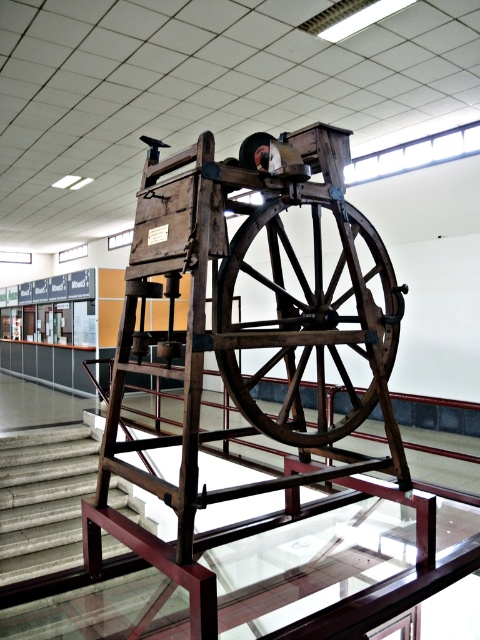
Does dark brown wooden wheel at center have a lesser height compared to concrete stairs at lower left?

No, dark brown wooden wheel at center is not shorter than concrete stairs at lower left.

This screenshot has width=480, height=640. Describe the element at coordinates (312, 273) in the screenshot. I see `dark brown wooden wheel at center` at that location.

Find the location of `dark brown wooden wheel at center`. dark brown wooden wheel at center is located at coordinates (312, 273).

At what (x,y) coordinates should I click in order to perform the action: click on dark brown wooden wheel at center. Please return your answer as a coordinate pair (x, y). Image resolution: width=480 pixels, height=640 pixels. Looking at the image, I should click on (312, 273).